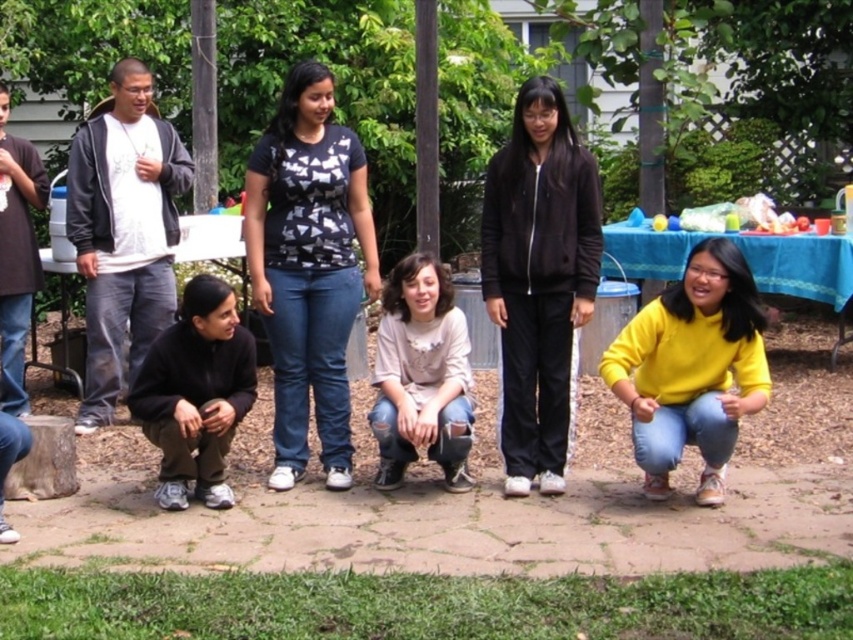
Consider the image. You are a photographer trying to capture a candid shot of the group. You notice the matte black jacket at left and the ripped denim jeans at center. Which object should you focus on first if you want to include both in your frame without moving the camera?

You should focus on the ripped denim jeans at center first because the matte black jacket at left is to the left of it, so centering on the jeans will ensure both are in the frame.

How far apart are the two people wearing the matte black jacket at left?

The two people wearing the matte black jacket at left are 21.04 feet apart.